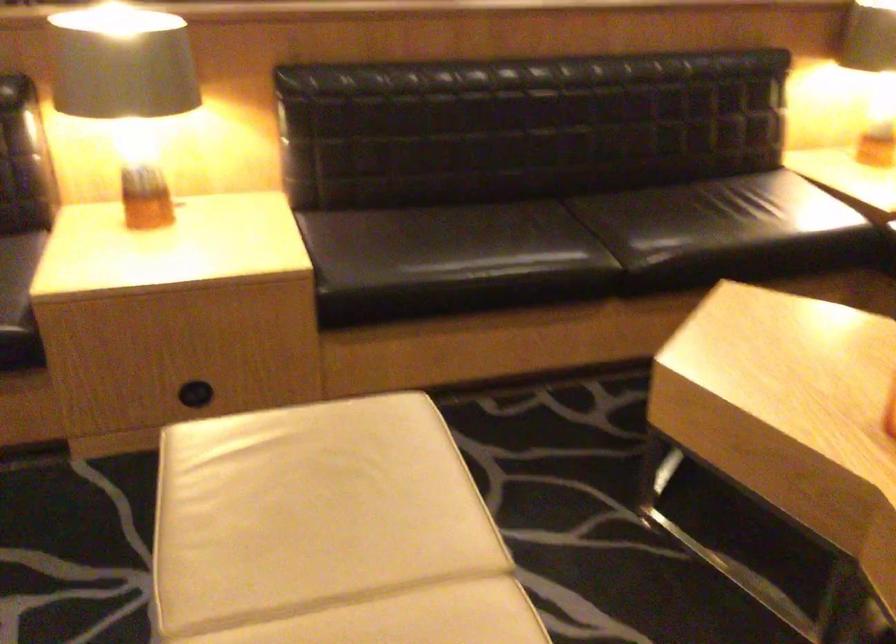
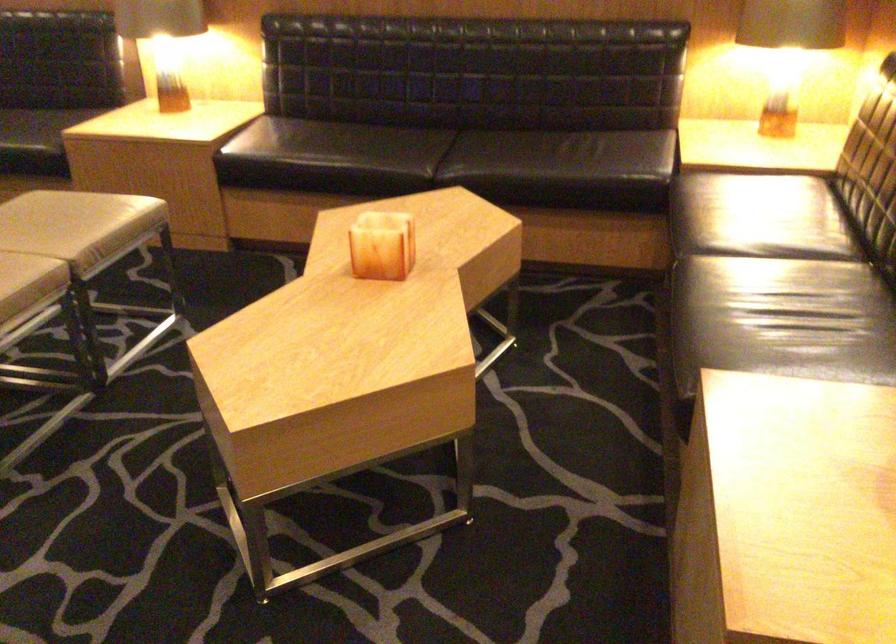
Locate, in the second image, the point that corresponds to point 464,459 in the first image.

(70, 223)